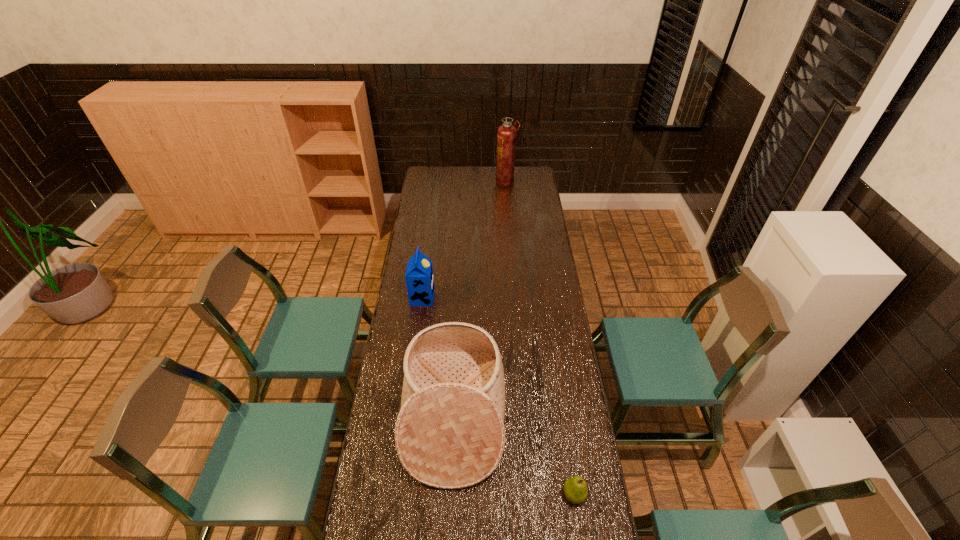
The width and height of the screenshot is (960, 540). In order to click on vacant space that satisfies the following two spatial constraints: 1. with the cap open on the carton; 2. on the back side of the rightmost object in this screenshot , I will do `click(397, 495)`.